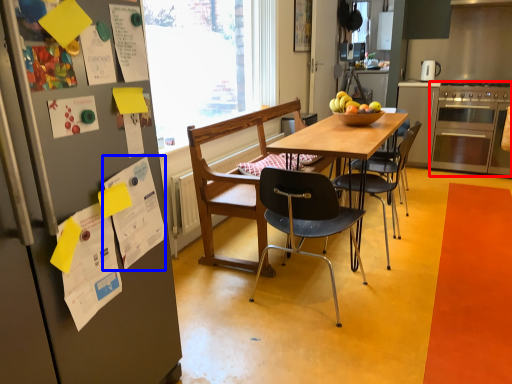
Question: Which of the following is the farthest to the observer, oven (highlighted by a red box) or poster (highlighted by a blue box)?

Choices:
 (A) oven
 (B) poster

Answer: (A)